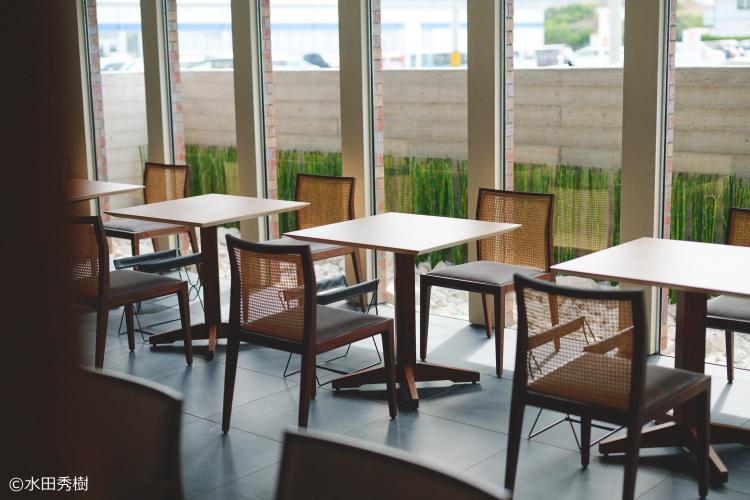
Where is `windows`? This screenshot has height=500, width=750. windows is located at coordinates (118, 57), (196, 53), (308, 53), (410, 57), (550, 68), (712, 73).